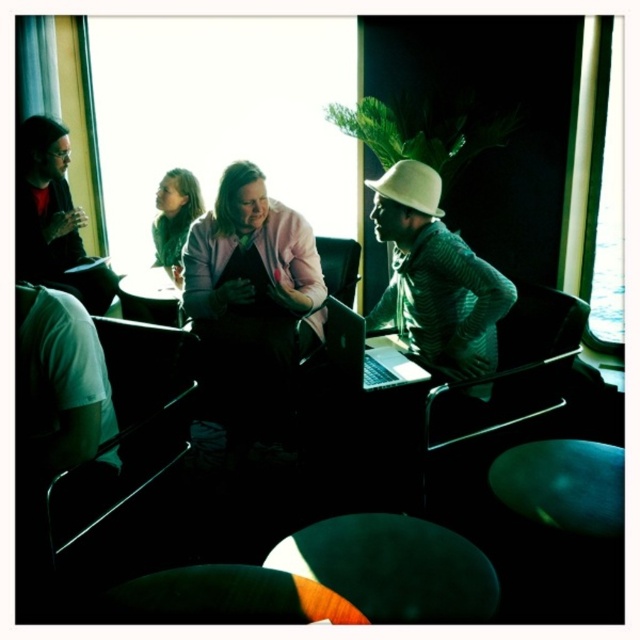
In the scene shown: You are standing in the room and want to place a small object on the closest surface between the green knitted sweater at center and the wooden round table at center. Which surface should you choose?

The green knitted sweater at center is closer to the viewer than the wooden round table at center, so you should place the small object on the green knitted sweater at center.

You are a photographer setting up a shoot in this room. You have a camera that can only focus on objects within a height range of 1.2 meters to 1.8 meters. You need to position the metallic silver chair at left and the white matte hat at center so that both are within the camera focus range. Is this possible?

The metallic silver chair at left is much taller than the white matte hat at center. If the chair is taller, it might exceed the upper focus limit of 1.8 meters, while the hat could be too low to meet the minimum 1.2 meters. Therefore, it may not be possible to position both within the focus range unless adjustments are made to their heights.

You are organizing a small gathering and need to know which object is bigger between the green knitted sweater at center and the wooden round table at center. Can you tell me which one is larger?

The green knitted sweater at center is larger in size than the wooden round table at center.